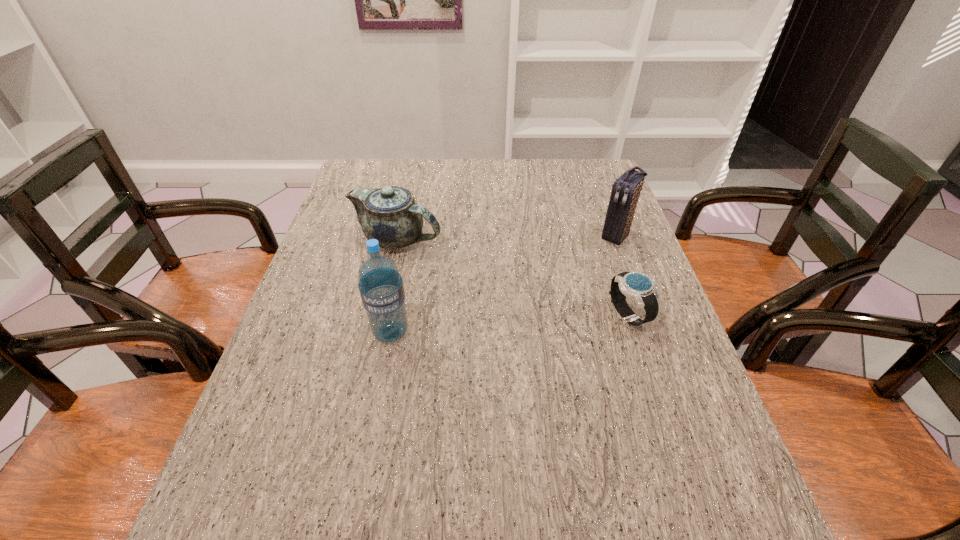
You are a GUI agent. You are given a task and a screenshot of the screen. Output one action in this format:
    pyautogui.click(x=<x>, y=<y>)
    Task: Click on the empty space that is in between the clutch bag and the chinaware
    Image resolution: width=960 pixels, height=540 pixels.
    Given the screenshot: What is the action you would take?
    pyautogui.click(x=507, y=238)

Identify the location of vacant space in between the clutch bag and the chinaware. The image size is (960, 540). (x=507, y=238).

Identify the location of empty space between the clutch bag and the water bottle. (504, 284).

You are a GUI agent. You are given a task and a screenshot of the screen. Output one action in this format:
    pyautogui.click(x=<x>, y=<y>)
    Task: Click on the vacant space that is in between the shortest object and the water bottle
    The width and height of the screenshot is (960, 540).
    Given the screenshot: What is the action you would take?
    pyautogui.click(x=510, y=324)

Image resolution: width=960 pixels, height=540 pixels. What are the coordinates of `free space between the shortest object and the chinaware` in the screenshot? It's located at (513, 277).

Identify the location of free point between the water bottle and the second tallest object. (504, 284).

You are a GUI agent. You are given a task and a screenshot of the screen. Output one action in this format:
    pyautogui.click(x=<x>, y=<y>)
    Task: Click on the free space between the water bottle and the third shortest object
    
    Given the screenshot: What is the action you would take?
    pyautogui.click(x=504, y=284)

The image size is (960, 540). In order to click on object that is the closest to the tallest object in this screenshot , I will do `click(390, 215)`.

Identify which object is located as the third nearest to the watch. Please provide its 2D coordinates. Your answer should be formatted as a tuple, i.e. [(x, y)], where the tuple contains the x and y coordinates of a point satisfying the conditions above.

[(381, 288)]

This screenshot has width=960, height=540. I want to click on blank space that satisfies the following two spatial constraints: 1. on the back side of the second tallest object; 2. on the left side of the second shortest object, so click(x=397, y=236).